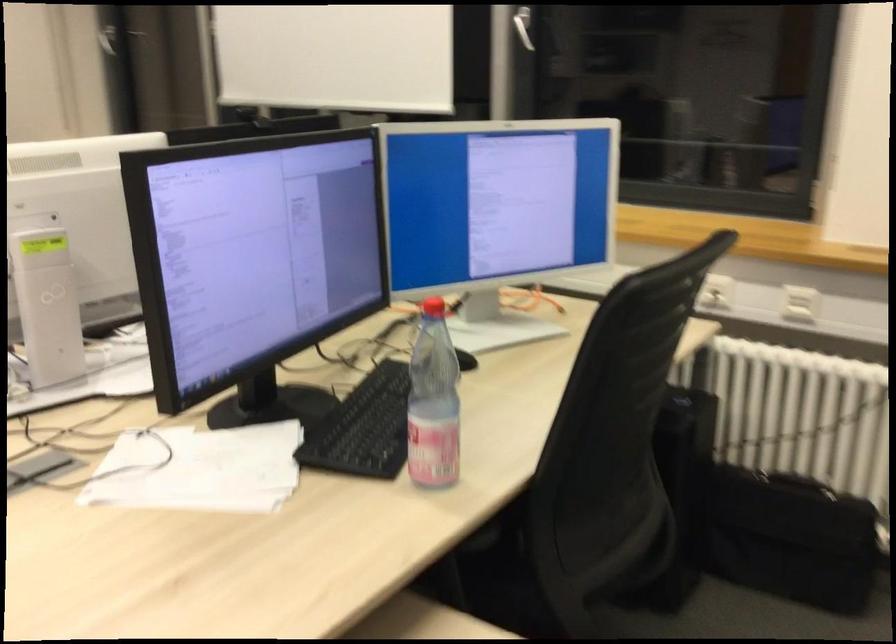
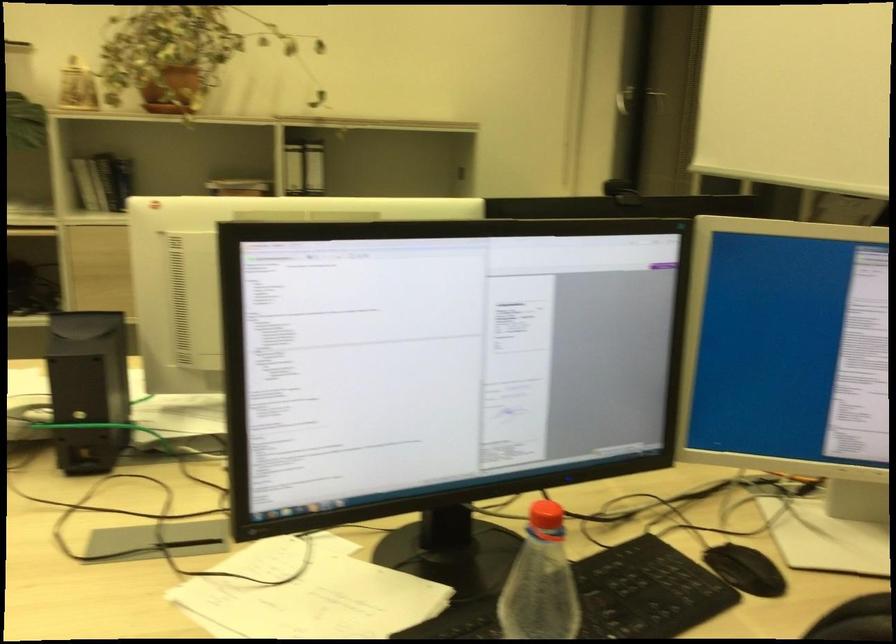
Question: The camera is either moving clockwise (left) or counter-clockwise (right) around the object. The first image is from the beginning of the video and the second image is from the end. Is the camera moving left or right when shooting the video?

Choices:
 (A) Left
 (B) Right

Answer: (B)